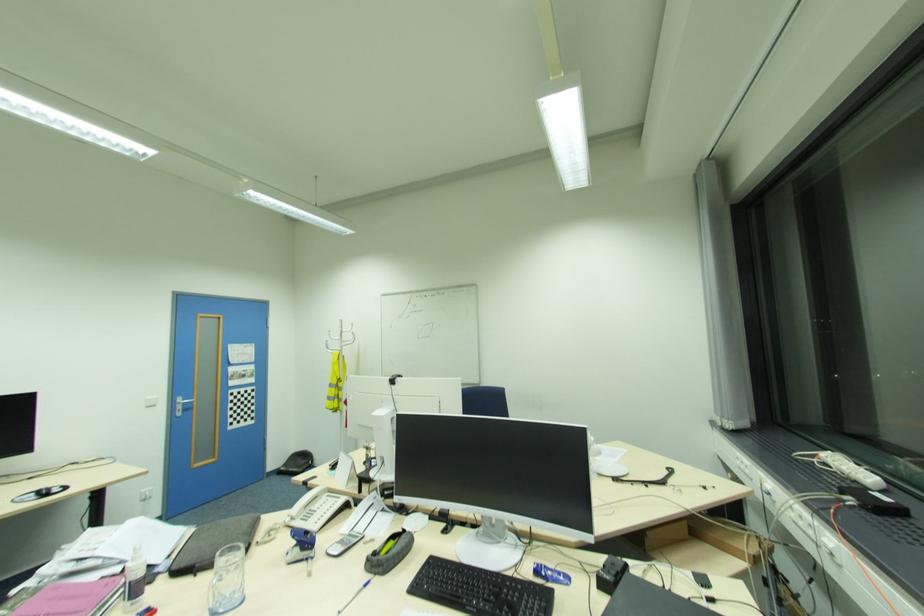
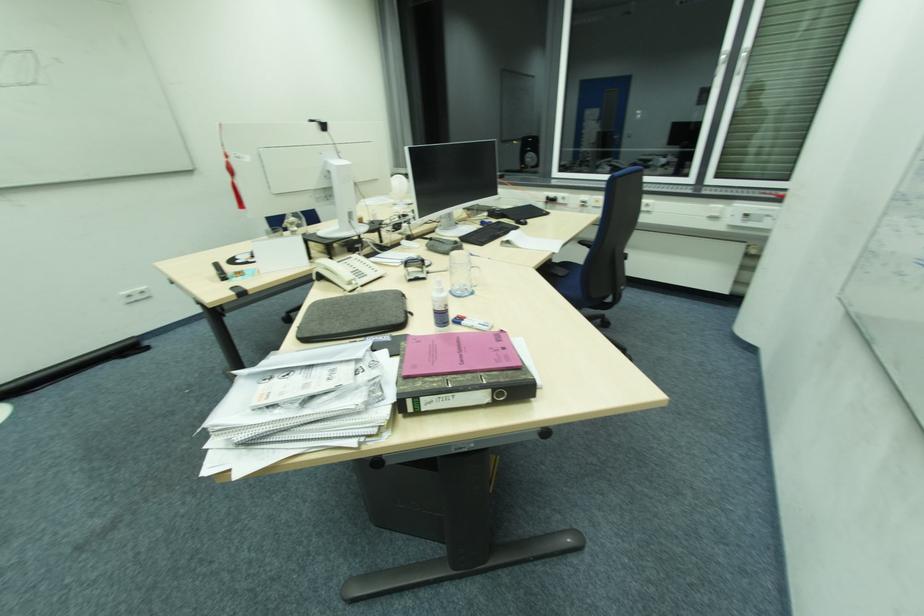
In the second image, find the point that corresponds to (x=331, y=495) in the first image.

(342, 262)